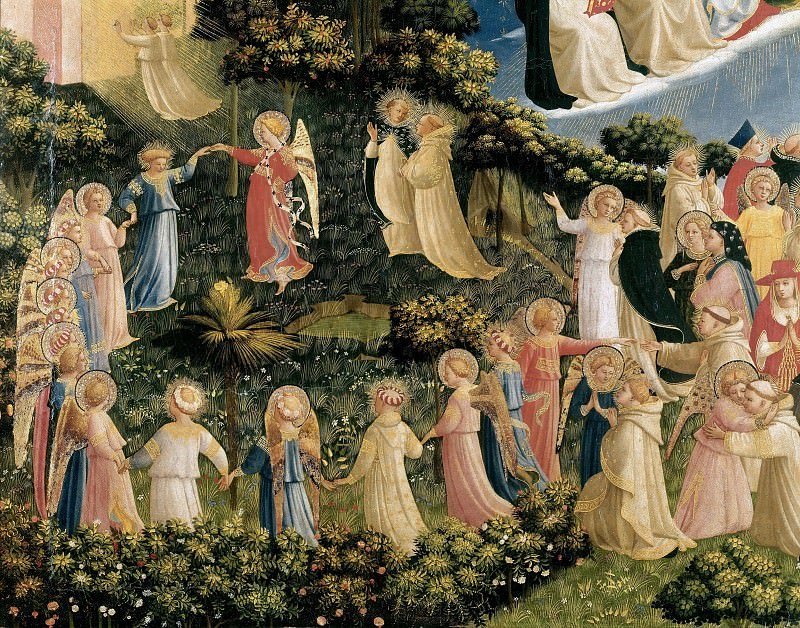
The image size is (800, 628). I want to click on blue cloth, so click(x=297, y=485).